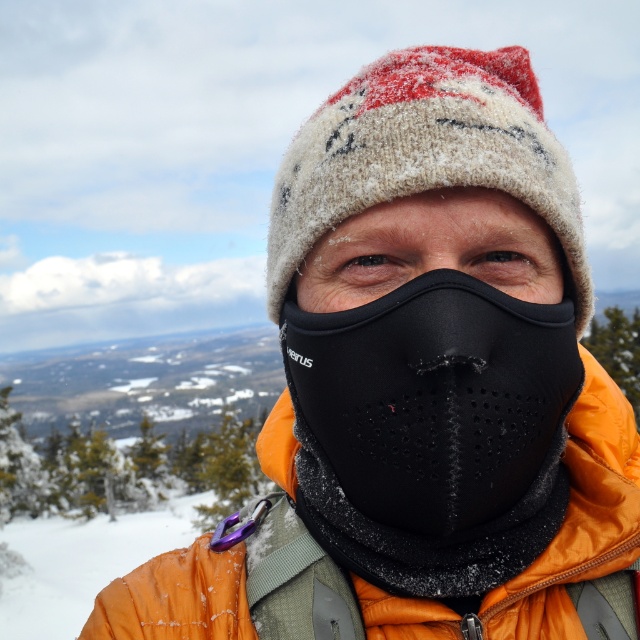
Question: Which of the following is the farthest from the observer?

Choices:
 (A) orange fleece jacket at center
 (B) fuzzy woolen hat at center

Answer: (A)

Question: Which object is positioned closest to the black mesh mask at center?

Choices:
 (A) black neoprene mask at center
 (B) fuzzy woolen hat at center
 (C) orange fleece jacket at center

Answer: (A)

Question: Among these objects, which one is nearest to the camera?

Choices:
 (A) orange fleece jacket at center
 (B) fuzzy woolen hat at center
 (C) black mesh mask at center

Answer: (C)

Question: Does black neoprene mask at center have a lesser width compared to black mesh mask at center?

Choices:
 (A) no
 (B) yes

Answer: (A)

Question: Is fuzzy woolen hat at center further to the viewer compared to black mesh mask at center?

Choices:
 (A) yes
 (B) no

Answer: (A)

Question: Is black neoprene mask at center above orange fleece jacket at center?

Choices:
 (A) yes
 (B) no

Answer: (A)